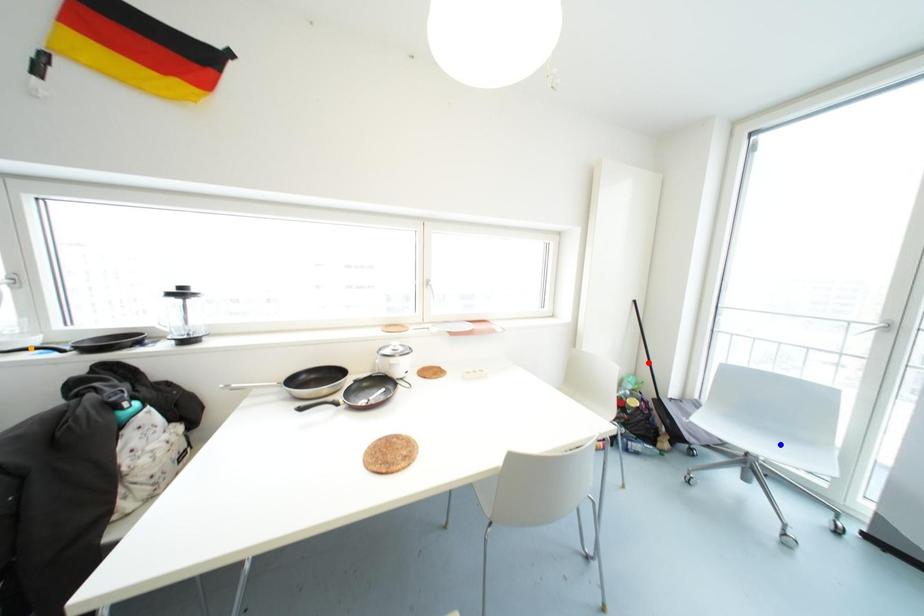
Order these from nearest to farthest:
orange point, blue point, red point

orange point → blue point → red point